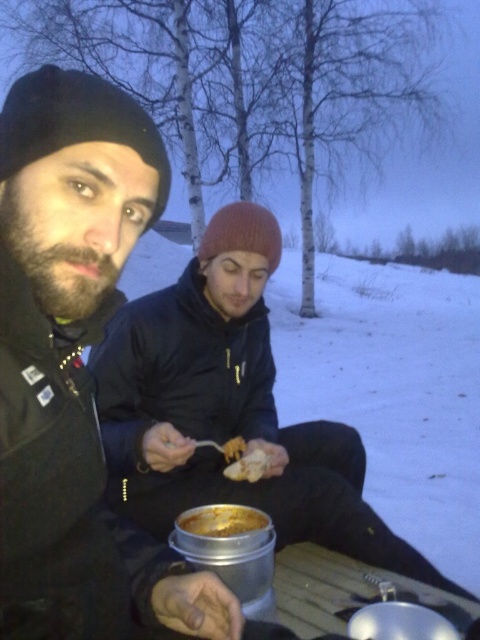
You are a photographer trying to capture both the golden brown crusty bread at center and the white crumbly bread at center in a single shot. Since you want both to be in focus, which bread should you adjust your camera focus to prioritize? Explain your reasoning based on their positions.

The golden brown crusty bread at center is closer to the viewer than the white crumbly bread at center. To ensure both are in focus, the photographer should set the focus on the golden brown crusty bread at center because focusing on the closer object maximizes the depth of field, making both objects sharp.

You are a photographer at the scene wanting to capture both the golden brown crusty bread at center and the white crumbly bread at center in a single shot. Which bread should you focus on first to ensure both are in frame without moving the camera?

The golden brown crusty bread at center has a lesser height compared to white crumbly bread at center, so you should focus on the taller white crumbly bread at center first to ensure depth of field captures both in the frame.